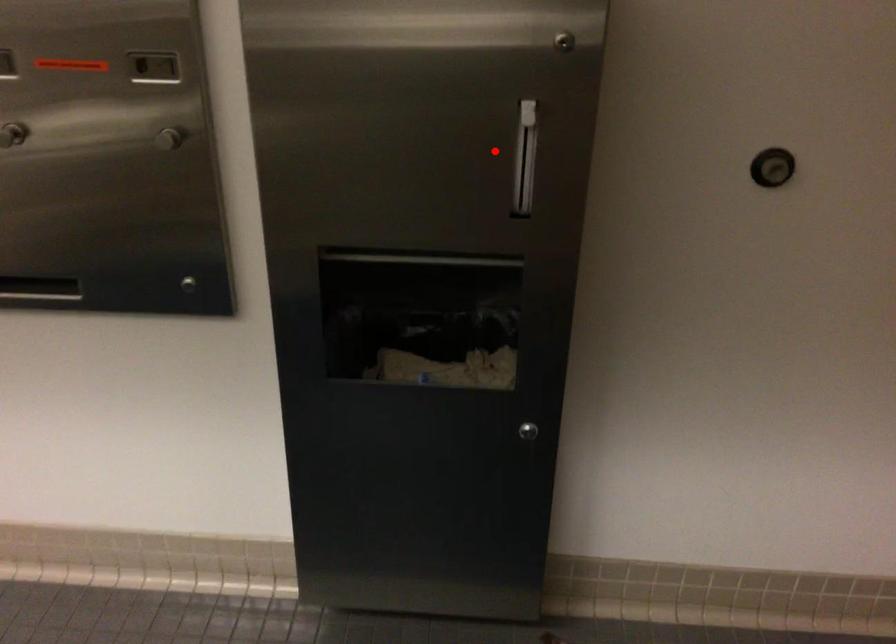
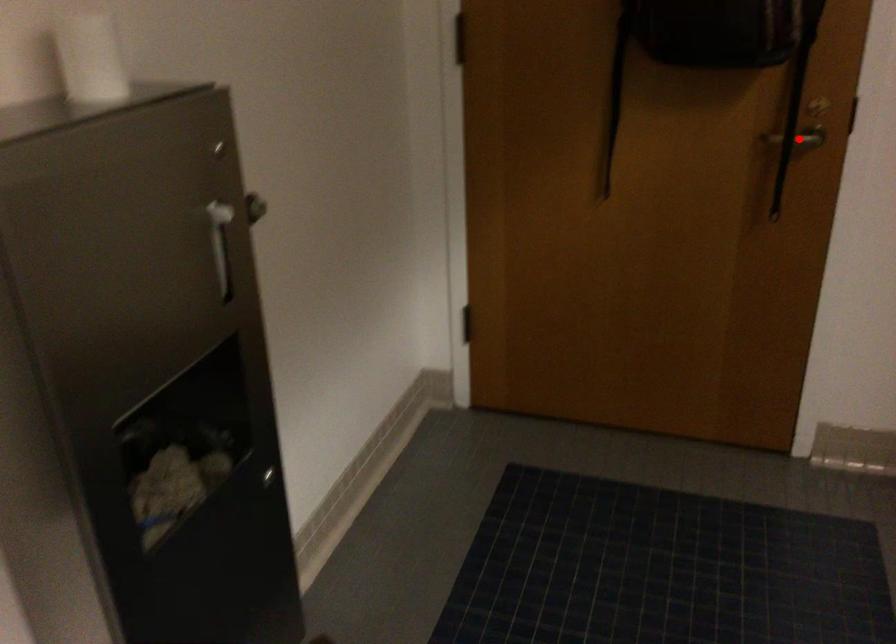
I am providing you with two images of the same scene from different viewpoints. A red point is marked on the first image and another point is marked on the second image. Do the highlighted points in image1 and image2 indicate the same real-world spot?

No